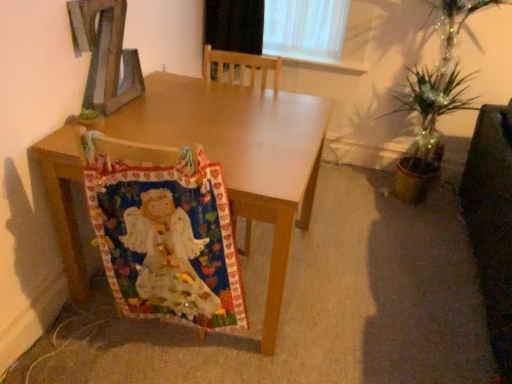
The width and height of the screenshot is (512, 384). I want to click on vacant area that is situated to the right of wooden table at center, so click(366, 267).